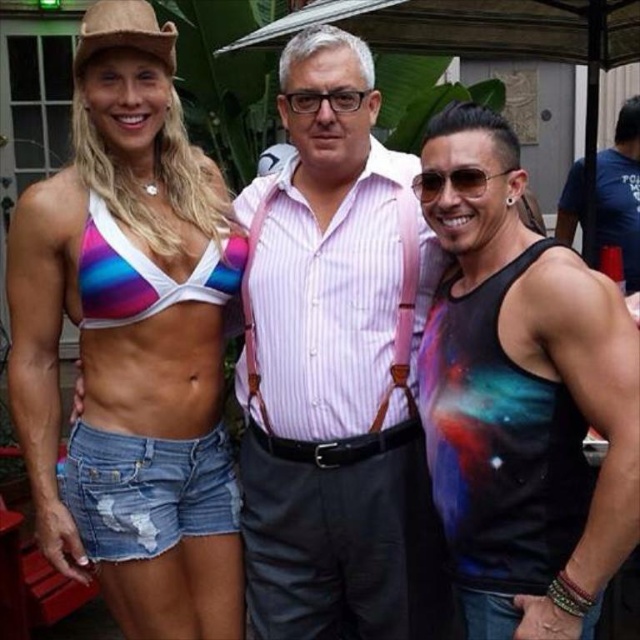
Question: Which point is closer to the camera?

Choices:
 (A) black printed tank top at center
 (B) rainbow fabric bikini top at left
 (C) rainbow fabric bikini top at upper left

Answer: (A)

Question: Does black printed tank top at center have a lesser width compared to rainbow fabric bikini top at left?

Choices:
 (A) yes
 (B) no

Answer: (B)

Question: Which point is farther from the camera taking this photo?

Choices:
 (A) (264, 372)
 (B) (588, 540)

Answer: (A)

Question: Does pink striped shirt at center have a greater width compared to denim shorts at lower left?

Choices:
 (A) yes
 (B) no

Answer: (A)

Question: Which object is the farthest from the black cotton t-shirt at right?

Choices:
 (A) denim shorts at lower left
 (B) rainbow fabric bikini top at upper left
 (C) black printed tank top at center

Answer: (A)

Question: Considering the relative positions of rainbow fabric bikini top at upper left and black printed tank top at center in the image provided, where is rainbow fabric bikini top at upper left located with respect to black printed tank top at center?

Choices:
 (A) right
 (B) left

Answer: (B)